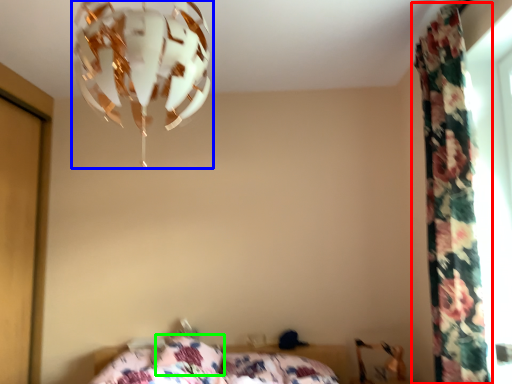
Question: Considering the real-world distances, which object is closest to curtain (highlighted by a red box)? lamp (highlighted by a blue box) or pillow (highlighted by a green box).

Choices:
 (A) lamp
 (B) pillow

Answer: (A)